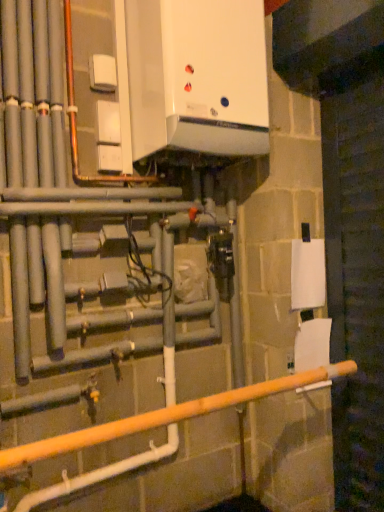
Question: Is white matte toilet paper at lower right, which is counted as the 2th toilet paper, starting from the top, looking in the opposite direction of white glossy boiler at upper center?

Choices:
 (A) yes
 (B) no

Answer: (B)

Question: Are white matte toilet paper at lower right, which is counted as the 2th toilet paper, starting from the top, and white glossy boiler at upper center located far from each other?

Choices:
 (A) yes
 (B) no

Answer: (A)

Question: Does white matte toilet paper at lower right, which is counted as the 2th toilet paper, starting from the top, have a greater width compared to white glossy boiler at upper center?

Choices:
 (A) no
 (B) yes

Answer: (A)

Question: From a real-world perspective, does white matte toilet paper at lower right, which is counted as the 2th toilet paper, starting from the top, stand above white glossy boiler at upper center?

Choices:
 (A) no
 (B) yes

Answer: (A)

Question: Is white matte toilet paper at lower right, which is counted as the 2th toilet paper, starting from the top, positioned in front of white glossy boiler at upper center?

Choices:
 (A) yes
 (B) no

Answer: (B)

Question: Is white matte toilet paper at lower right, the first toilet paper from the bottom, placed right next to white glossy boiler at upper center?

Choices:
 (A) no
 (B) yes

Answer: (A)

Question: Is white matte toilet paper at lower right, the first toilet paper from the bottom, to the right of white matte toilet paper at right, which appears as the first toilet paper when viewed from the top, from the viewer's perspective?

Choices:
 (A) no
 (B) yes

Answer: (B)

Question: From the image's perspective, is white matte toilet paper at lower right, the first toilet paper from the bottom, on white matte toilet paper at right, which appears as the first toilet paper when viewed from the top?

Choices:
 (A) no
 (B) yes

Answer: (A)

Question: Is white matte toilet paper at lower right, which is counted as the 2th toilet paper, starting from the top, behind white matte toilet paper at right, which is the second toilet paper from bottom to top?

Choices:
 (A) no
 (B) yes

Answer: (A)

Question: Considering the relative sizes of white matte toilet paper at lower right, which is counted as the 2th toilet paper, starting from the top, and white matte toilet paper at right, which appears as the first toilet paper when viewed from the top, in the image provided, is white matte toilet paper at lower right, which is counted as the 2th toilet paper, starting from the top, thinner than white matte toilet paper at right, which appears as the first toilet paper when viewed from the top,?

Choices:
 (A) no
 (B) yes

Answer: (A)

Question: From the image's perspective, would you say white matte toilet paper at lower right, the first toilet paper from the bottom, is shown under white matte toilet paper at right, which is the second toilet paper from bottom to top?

Choices:
 (A) no
 (B) yes

Answer: (B)

Question: Does white matte toilet paper at lower right, the first toilet paper from the bottom, have a greater width compared to white matte toilet paper at right, which is the second toilet paper from bottom to top?

Choices:
 (A) no
 (B) yes

Answer: (B)

Question: Could you tell me if white matte toilet paper at lower right, which is counted as the 2th toilet paper, starting from the top, is turned towards wooden pole at lower center?

Choices:
 (A) yes
 (B) no

Answer: (A)